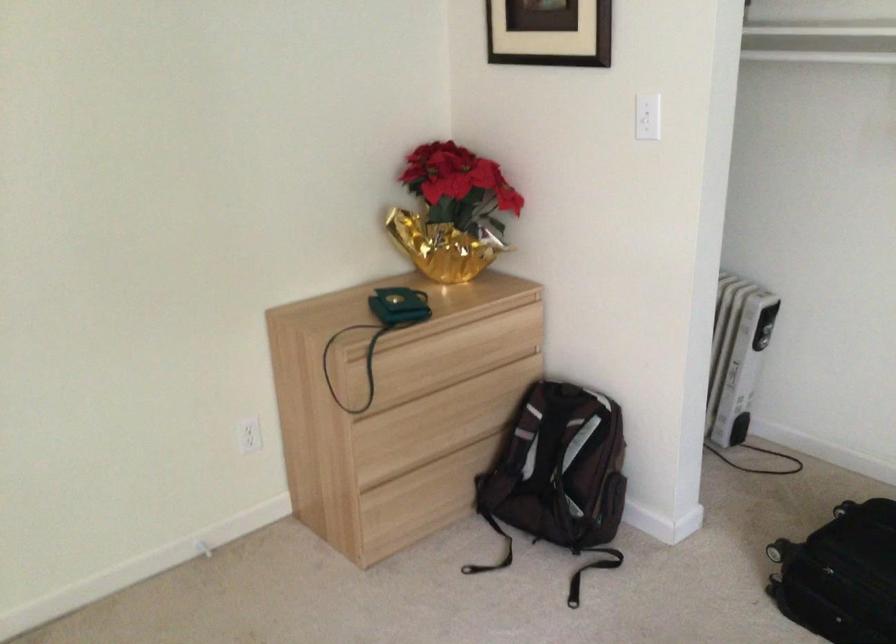
Where is `small green purse`? This screenshot has height=644, width=896. small green purse is located at coordinates (399, 306).